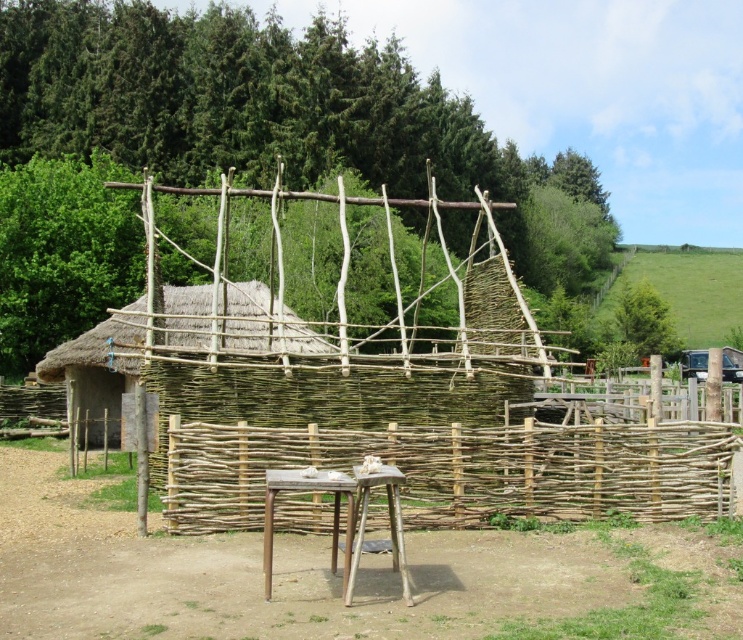
Is the position of brown dirt field at center less distant than that of thatched straw hut at center?

Yes.

Which is above, brown dirt field at center or thatched straw hut at center?

thatched straw hut at center is above.

Does point (681, 552) come behind point (155, 339)?

No, it is not.

In order to click on brown dirt field at center in this screenshot , I will do `click(317, 573)`.

Does point (438, 432) come behind point (100, 416)?

No, (438, 432) is closer to viewer.

Is point (415, 442) positioned in front of point (88, 372)?

Yes.

Where is `natural wood fence at center`? The image size is (743, 640). natural wood fence at center is located at coordinates (461, 470).

You are a GUI agent. You are given a task and a screenshot of the screen. Output one action in this format:
    pyautogui.click(x=<x>, y=<y>)
    Task: Click on the natural wood fence at center
    This screenshot has height=640, width=743.
    Given the screenshot: What is the action you would take?
    pyautogui.click(x=461, y=470)

In the scene shown: Does brown dirt field at center have a smaller size compared to wooden picnic table at center?

Incorrect, brown dirt field at center is not smaller in size than wooden picnic table at center.

You are a GUI agent. You are given a task and a screenshot of the screen. Output one action in this format:
    pyautogui.click(x=<x>, y=<y>)
    Task: Click on the brown dirt field at center
    Image resolution: width=743 pixels, height=640 pixels.
    Given the screenshot: What is the action you would take?
    pyautogui.click(x=317, y=573)